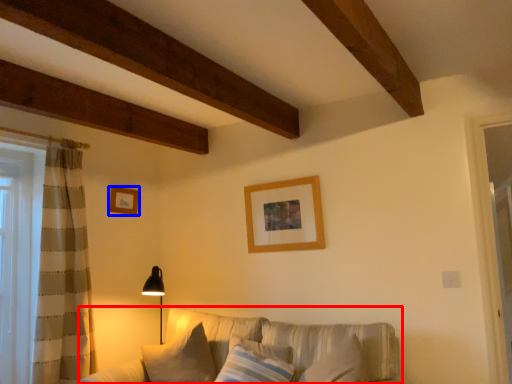
Question: Which of the following is the farthest to the observer, studio couch (highlighted by a red box) or picture frame (highlighted by a blue box)?

Choices:
 (A) studio couch
 (B) picture frame

Answer: (B)